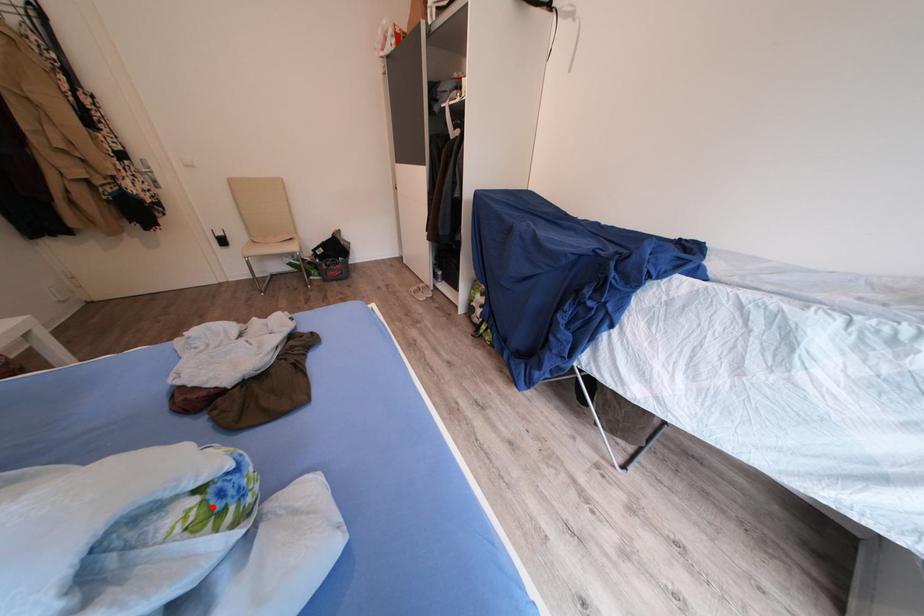
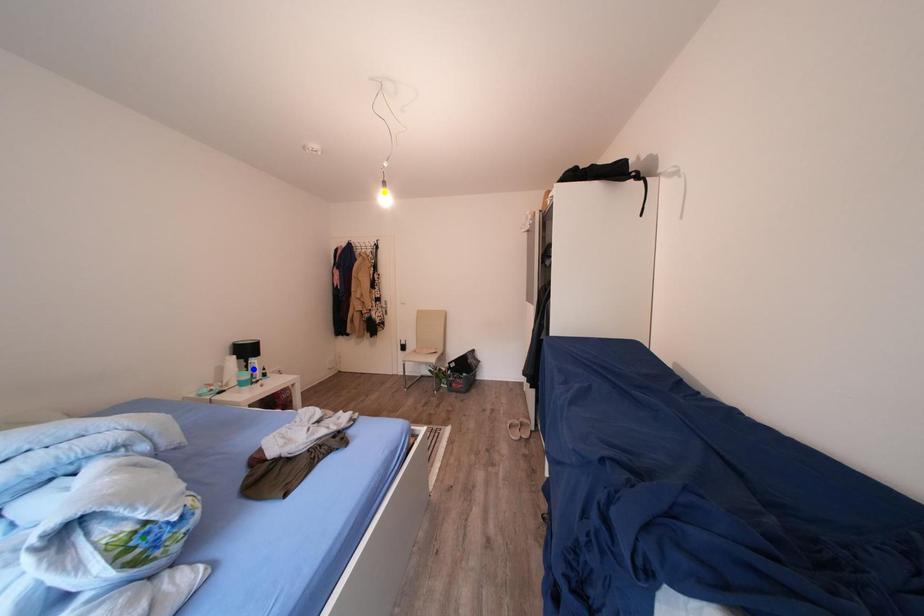
Question: I am providing you with two images of the same scene from different viewpoints. A red point is marked on the first image. You are given multiple points on the second image. Which spot in image 2 lines up with the point in image 1?

Choices:
 (A) yellow point
 (B) blue point
 (C) green point

Answer: (C)